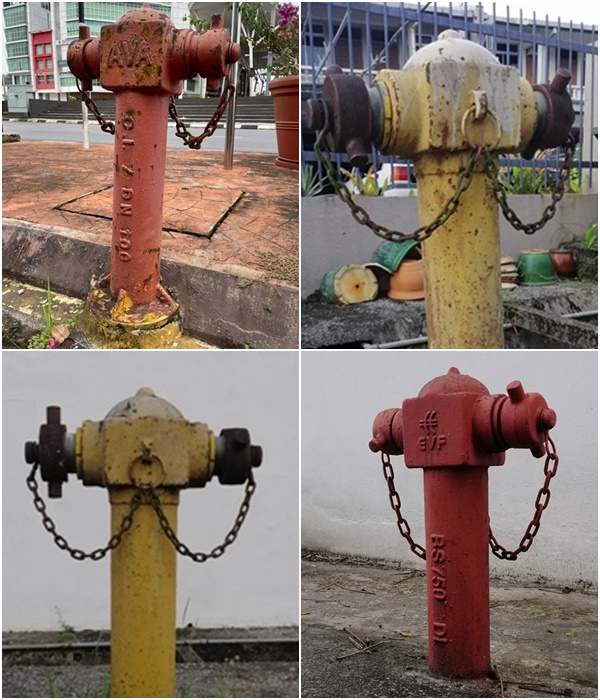
Image resolution: width=600 pixels, height=700 pixels. Identify the location of wall. (352, 502).